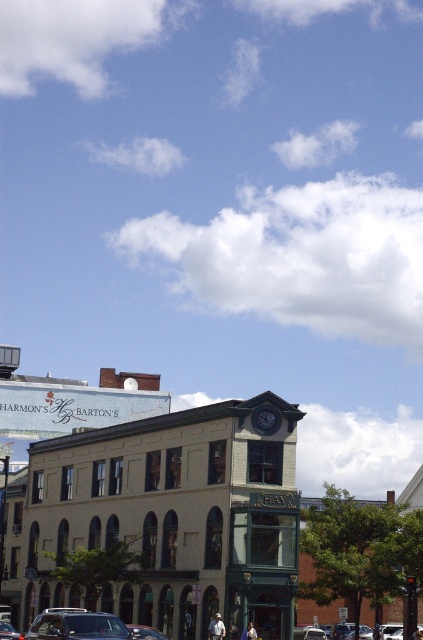
You are standing at the intersection of two streets and see the beige stone building at center. If you want to walk directly towards it, which direction should you head?

The beige stone building at center is located at point 0.814 on the x axis and 0.383 on the y axis, so you should head towards the direction where the coordinates increase in the x direction and decrease slightly in the y direction to reach it.